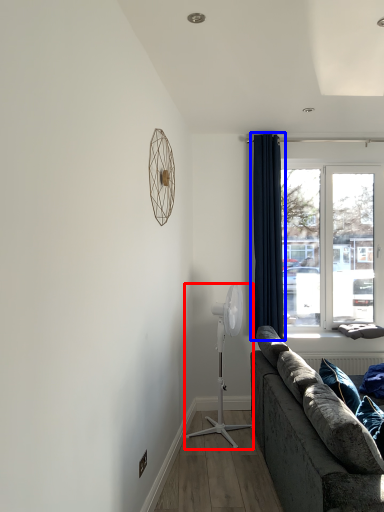
Question: Among these objects, which one is farthest to the camera, mechanical fan (highlighted by a red box) or curtain (highlighted by a blue box)?

Choices:
 (A) mechanical fan
 (B) curtain

Answer: (B)